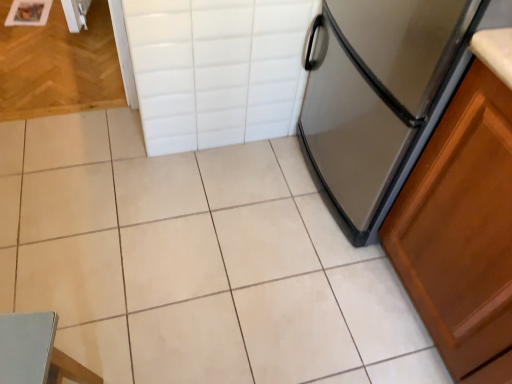
Locate an element on the screen. The image size is (512, 384). free space in front of white tile drawer at upper center is located at coordinates (216, 202).